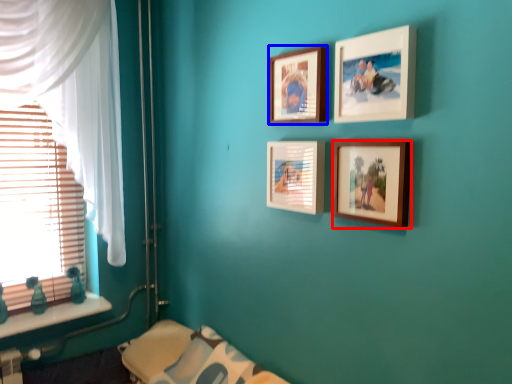
Question: Which object is closer to the camera taking this photo, picture frame (highlighted by a red box) or picture frame (highlighted by a blue box)?

Choices:
 (A) picture frame
 (B) picture frame

Answer: (A)